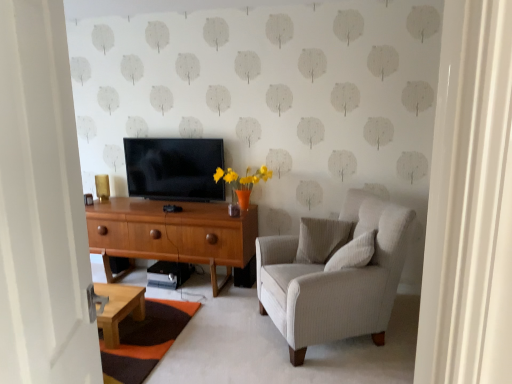
Question: From a real-world perspective, is white textured pillow at center, acting as the 2th pillow starting from the front, positioned over light gray fabric armchair at right based on gravity?

Choices:
 (A) no
 (B) yes

Answer: (B)

Question: Does white textured pillow at center, acting as the 2th pillow starting from the front, have a larger size compared to light gray fabric armchair at right?

Choices:
 (A) no
 (B) yes

Answer: (A)

Question: Is light gray fabric armchair at right surrounded by white textured pillow at center, arranged as the 1th pillow when viewed from the back?

Choices:
 (A) yes
 (B) no

Answer: (B)

Question: Does white textured pillow at center, acting as the 2th pillow starting from the front, have a smaller size compared to light gray fabric armchair at right?

Choices:
 (A) yes
 (B) no

Answer: (A)

Question: From the image's perspective, does white textured pillow at center, arranged as the 1th pillow when viewed from the back, appear higher than light gray fabric armchair at right?

Choices:
 (A) yes
 (B) no

Answer: (A)

Question: Does white textured pillow at center, acting as the 2th pillow starting from the front, have a lesser width compared to light gray fabric armchair at right?

Choices:
 (A) yes
 (B) no

Answer: (A)

Question: From a real-world perspective, is white wooden door at left positioned over woodendesk at center based on gravity?

Choices:
 (A) no
 (B) yes

Answer: (B)

Question: Is woodendesk at center a part of white wooden door at left?

Choices:
 (A) no
 (B) yes

Answer: (A)

Question: Is white wooden door at left facing towards woodendesk at center?

Choices:
 (A) no
 (B) yes

Answer: (A)

Question: Is white wooden door at left further to the viewer compared to woodendesk at center?

Choices:
 (A) no
 (B) yes

Answer: (A)

Question: From the image's perspective, is white wooden door at left on woodendesk at center?

Choices:
 (A) yes
 (B) no

Answer: (A)

Question: Is white wooden door at left turned away from woodendesk at center?

Choices:
 (A) no
 (B) yes

Answer: (A)

Question: Is white wooden door at left facing away from white textured pillow at center, acting as the 2th pillow starting from the front?

Choices:
 (A) yes
 (B) no

Answer: (B)